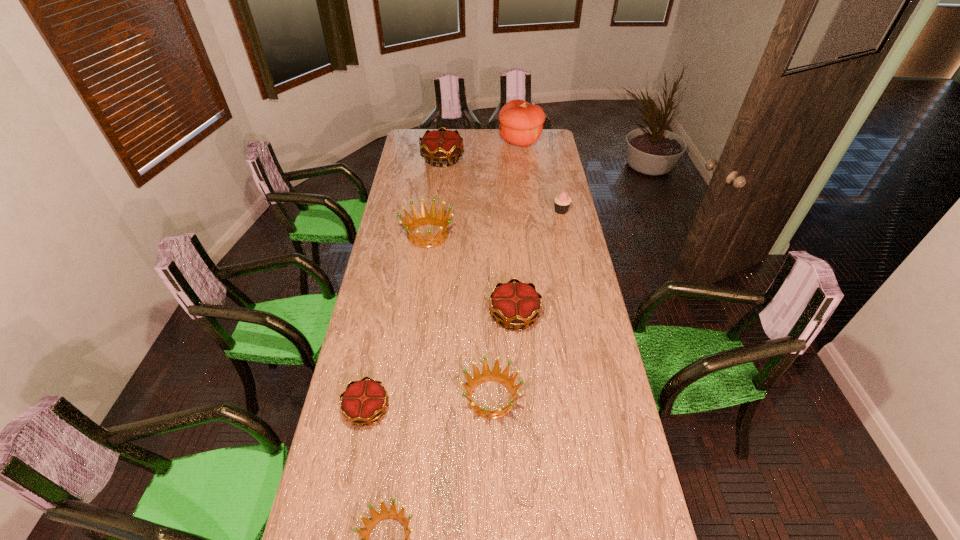
What are the coordinates of `crown that is the fourth closest to the nearest object` in the screenshot? It's located at (424, 218).

Identify which gold crown is the second nearest to the nearest golden crown. Please provide its 2D coordinates. Your answer should be formatted as a tuple, i.e. [(x, y)], where the tuple contains the x and y coordinates of a point satisfying the conditions above.

[(517, 304)]

Image resolution: width=960 pixels, height=540 pixels. I want to click on gold crown that is the closest to the third farthest crown, so click(x=364, y=401).

Point out which golden crown is positioned as the nearest to the nearest object. Please provide its 2D coordinates. Your answer should be formatted as a tuple, i.e. [(x, y)], where the tuple contains the x and y coordinates of a point satisfying the conditions above.

[(503, 378)]

You are a GUI agent. You are given a task and a screenshot of the screen. Output one action in this format:
    pyautogui.click(x=<x>, y=<y>)
    Task: Click on the golden crown that can be found as the second closest to the pink cupcake
    
    Given the screenshot: What is the action you would take?
    point(503,378)